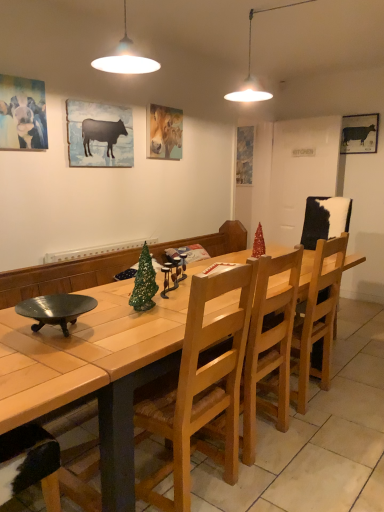
Identify the location of empty space that is to the right of shiny metallic bowl at lower left. (122, 333).